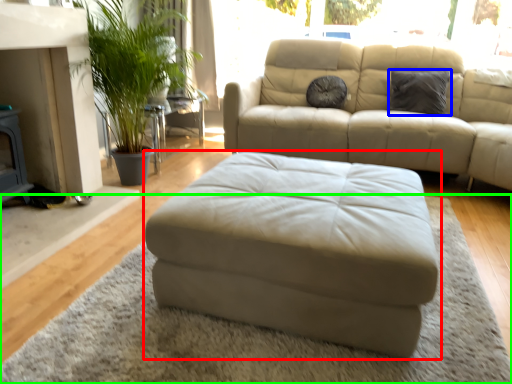
Question: Which object is the closest to the studio couch (highlighted by a red box)? Choose among these: pillow (highlighted by a blue box) or mat (highlighted by a green box).

Choices:
 (A) pillow
 (B) mat

Answer: (B)